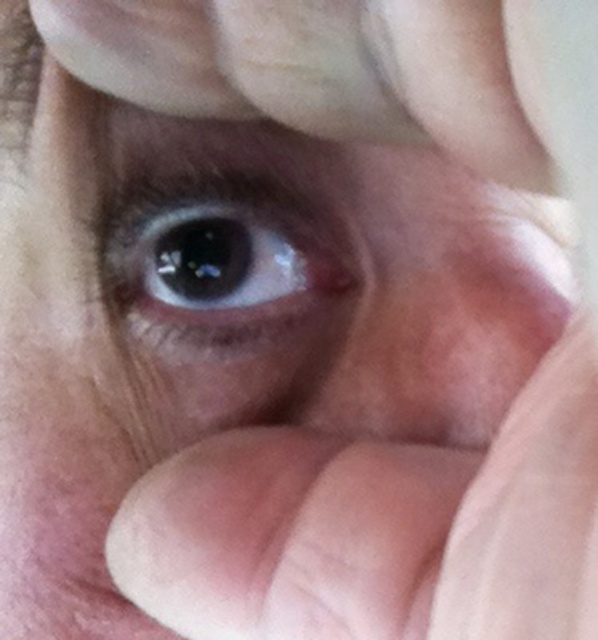
Which is more to the left, smooth skin at center or dry skin at center?

smooth skin at center is more to the left.

Who is more distant from viewer, (413, 637) or (437, 401)?

The point (437, 401) is behind.

Find the location of a particular element. Image resolution: width=598 pixels, height=640 pixels. smooth skin at center is located at coordinates [288, 536].

Is dry skin at center to the right of brown matte eye at center from the viewer's perspective?

Yes, dry skin at center is to the right of brown matte eye at center.

Is point (496, 397) farther from viewer compared to point (205, 205)?

No, (496, 397) is closer to viewer.

Between point (544, 353) and point (145, 198), which one is positioned behind?

The point (145, 198) is behind.

Where is `dry skin at center`? dry skin at center is located at coordinates (450, 339).

Is point (251, 630) positioned behind point (117, 282)?

No, (251, 630) is closer to viewer.

Which of these two, smooth skin at center or brown matte eye at center, stands shorter?

smooth skin at center is shorter.

Which is behind, point (359, 538) or point (263, 339)?

Point (263, 339)

The height and width of the screenshot is (640, 598). Identify the location of smooth skin at center. (288, 536).